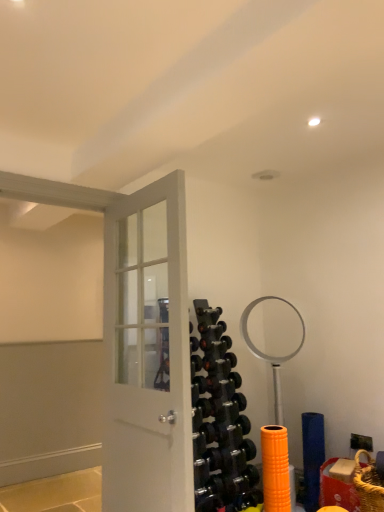
Question: Is black rubber dumbbell at center, arranged as the 3th dumbbell when viewed from the top, positioned in front of black rubber dumbbell at center, which is counted as the first dumbbell, starting from the top?

Choices:
 (A) yes
 (B) no

Answer: (A)

Question: Does black rubber dumbbell at center, arranged as the 3th dumbbell when viewed from the top, have a lesser height compared to black rubber dumbbell at center, which is counted as the first dumbbell, starting from the top?

Choices:
 (A) no
 (B) yes

Answer: (A)

Question: Are black rubber dumbbell at center, which is counted as the first dumbbell, starting from the bottom, and black rubber dumbbell at center, which is counted as the first dumbbell, starting from the top, far apart?

Choices:
 (A) yes
 (B) no

Answer: (B)

Question: Is black rubber dumbbell at center, which is counted as the first dumbbell, starting from the bottom, aimed at black rubber dumbbell at center, acting as the 3th dumbbell starting from the bottom?

Choices:
 (A) no
 (B) yes

Answer: (A)

Question: Is black rubber dumbbell at center, arranged as the 3th dumbbell when viewed from the top, further to the viewer compared to black rubber dumbbell at center, acting as the 3th dumbbell starting from the bottom?

Choices:
 (A) yes
 (B) no

Answer: (B)

Question: From a real-world perspective, relative to black rubber dumbbell at center, placed as the 2th dumbbell when sorted from bottom to top, is black rubber dumbbell at center, acting as the 3th dumbbell starting from the bottom, vertically above or below?

Choices:
 (A) above
 (B) below

Answer: (A)

Question: Is point (211, 347) positioned closer to the camera than point (230, 355)?

Choices:
 (A) farther
 (B) closer

Answer: (A)

Question: From the image's perspective, is black rubber dumbbell at center, acting as the 3th dumbbell starting from the bottom, above or below black rubber dumbbell at center, placed as the 2th dumbbell when sorted from bottom to top?

Choices:
 (A) above
 (B) below

Answer: (A)

Question: Is black rubber dumbbell at center, acting as the 3th dumbbell starting from the bottom, situated inside black rubber dumbbell at center, the 2th dumbbell in the top-to-bottom sequence, or outside?

Choices:
 (A) inside
 (B) outside

Answer: (B)

Question: In terms of width, does black rubber dumbbell at center, which is counted as the first dumbbell, starting from the bottom, look wider or thinner when compared to white glossy door at center?

Choices:
 (A) wide
 (B) thin

Answer: (B)

Question: Is black rubber dumbbell at center, arranged as the 3th dumbbell when viewed from the top, situated inside white glossy door at center or outside?

Choices:
 (A) outside
 (B) inside

Answer: (A)

Question: From a real-world perspective, relative to white glossy door at center, is black rubber dumbbell at center, which is counted as the first dumbbell, starting from the bottom, vertically above or below?

Choices:
 (A) above
 (B) below

Answer: (B)

Question: From the image's perspective, is black rubber dumbbell at center, which is counted as the first dumbbell, starting from the bottom, above or below white glossy door at center?

Choices:
 (A) above
 (B) below

Answer: (B)

Question: In terms of width, does black rubber dumbbell at center, placed as the 2th dumbbell when sorted from bottom to top, look wider or thinner when compared to black rubber dumbbell at center, acting as the 3th dumbbell starting from the bottom?

Choices:
 (A) wide
 (B) thin

Answer: (A)

Question: Looking at the image, does black rubber dumbbell at center, placed as the 2th dumbbell when sorted from bottom to top, seem bigger or smaller compared to black rubber dumbbell at center, which is counted as the first dumbbell, starting from the top?

Choices:
 (A) small
 (B) big

Answer: (B)